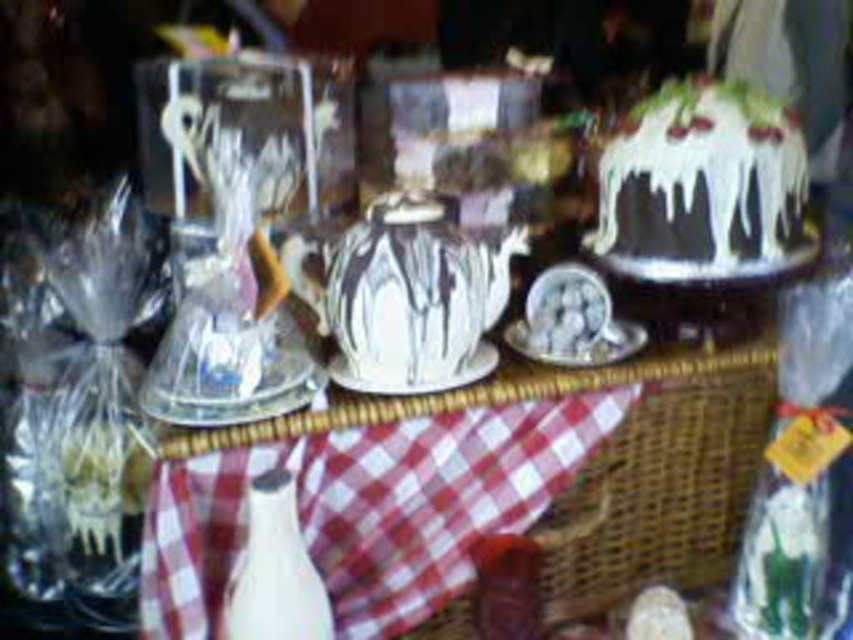
Between white glossy bottle at center and matte white plate at center, which one is positioned higher?

matte white plate at center is higher up.

Can you confirm if white glossy bottle at center is thinner than matte white plate at center?

Yes.

Measure the distance between white glossy bottle at center and camera.

white glossy bottle at center and camera are 3.80 feet apart.

You are a GUI agent. You are given a task and a screenshot of the screen. Output one action in this format:
    pyautogui.click(x=<x>, y=<y>)
    Task: Click on the white glossy bottle at center
    The height and width of the screenshot is (640, 853).
    Given the screenshot: What is the action you would take?
    pyautogui.click(x=274, y=570)

Does white glossy cake at upper right have a lesser height compared to white glossy bottle at center?

No.

Is white glossy cake at upper right to the left of white glossy bottle at center from the viewer's perspective?

Incorrect, white glossy cake at upper right is not on the left side of white glossy bottle at center.

Which is behind, point (636, 216) or point (288, 481)?

The point (636, 216) is more distant.

This screenshot has width=853, height=640. Find the location of `white glossy cake at upper right`. white glossy cake at upper right is located at coordinates (701, 186).

This screenshot has width=853, height=640. Describe the element at coordinates (701, 186) in the screenshot. I see `white glossy cake at upper right` at that location.

Does white glossy cake at upper right appear on the left side of matte white plate at center?

Incorrect, white glossy cake at upper right is not on the left side of matte white plate at center.

Does point (701, 259) come closer to viewer compared to point (587, 336)?

That is False.

Where is `white glossy cake at upper right`? white glossy cake at upper right is located at coordinates (701, 186).